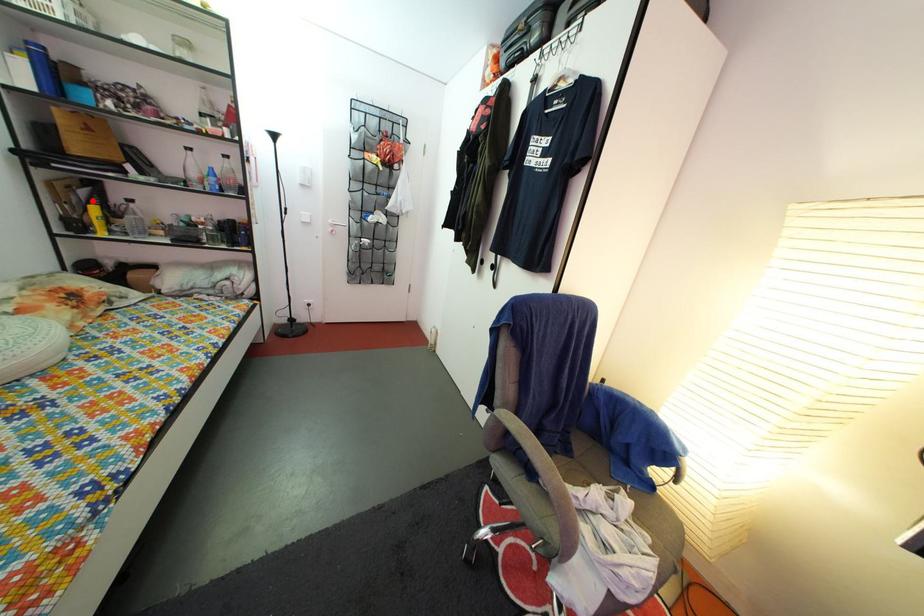
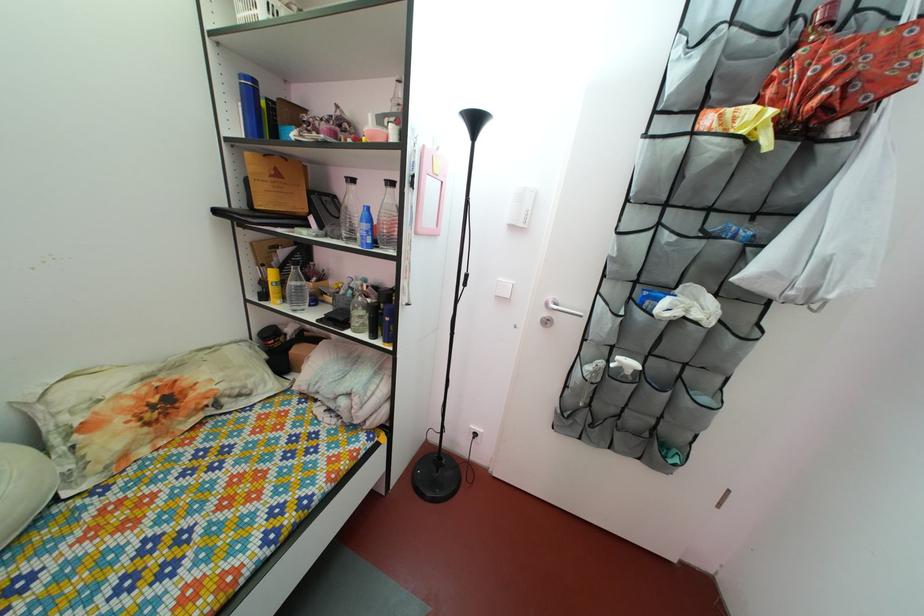
Question: A red point is marked in image1. In image2, is the corresponding 3D point closer to the camera or farther? Reply with the corresponding letter.

Choices:
 (A) The corresponding 3D point is closer.
 (B) The corresponding 3D point is farther.

Answer: (A)